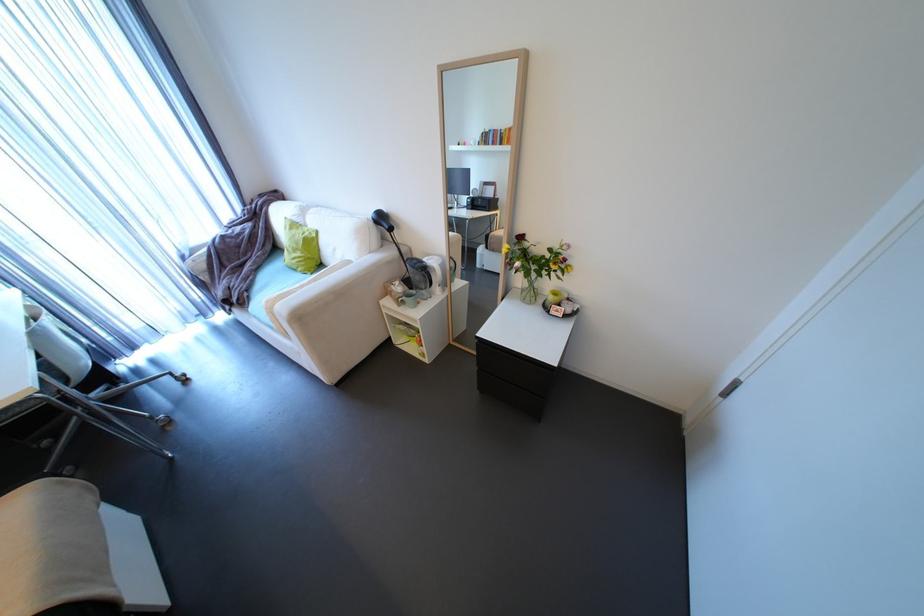
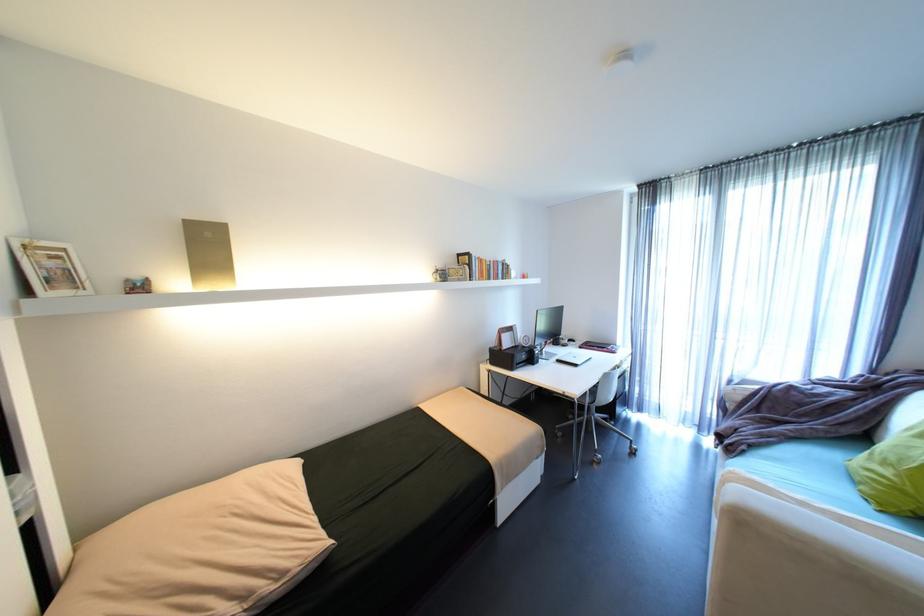
First-person continuous shooting, in which direction is the camera rotating?

The camera's rotation is toward left-down.